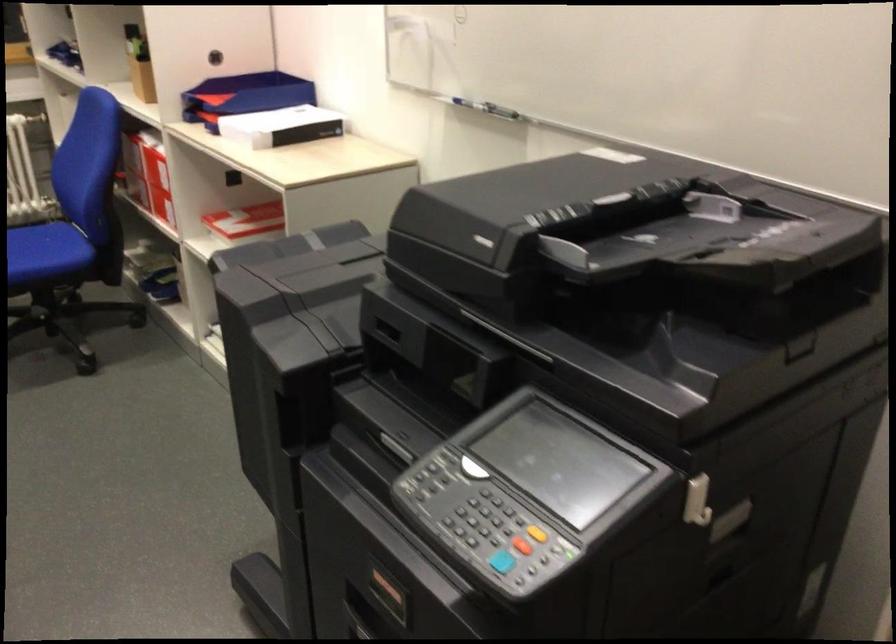
Describe the element at coordinates (546, 212) in the screenshot. This screenshot has width=896, height=644. I see `the black printer lid` at that location.